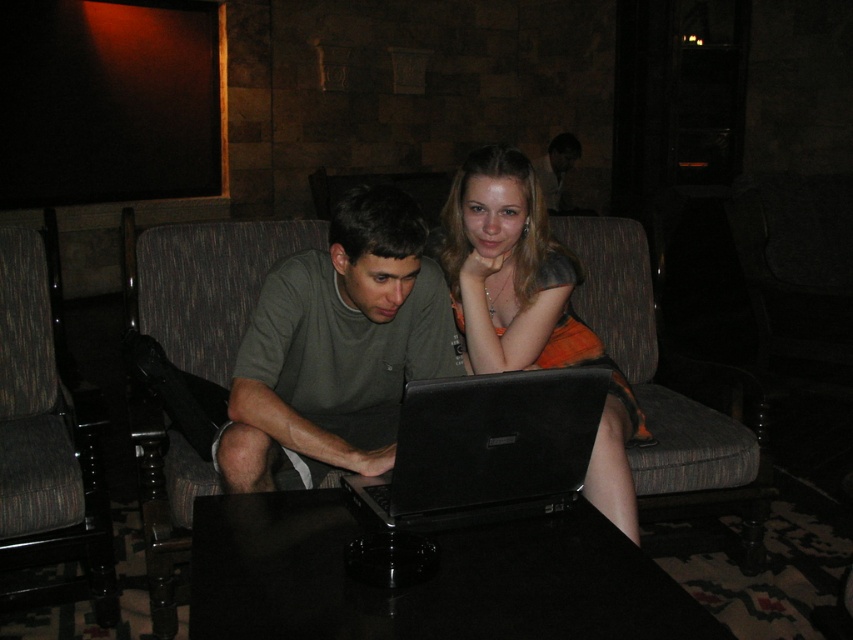
Is point (375, 234) positioned in front of point (437, 600)?

No, it is behind (437, 600).

Who is shorter, matte black laptop at center or black glossy table at center?

Standing shorter between the two is black glossy table at center.

Is point (395, 275) more distant than point (410, 600)?

Yes, it is behind point (410, 600).

This screenshot has width=853, height=640. Find the location of `matte black laptop at center`. matte black laptop at center is located at coordinates (412, 333).

The height and width of the screenshot is (640, 853). I want to click on matte black laptop at center, so click(x=412, y=333).

Describe the element at coordinates (412, 333) in the screenshot. I see `matte black laptop at center` at that location.

Who is more distant from viewer, (299, 456) or (184, 244)?

Positioned behind is point (184, 244).

At what (x,y) coordinates should I click in order to perform the action: click on matte black laptop at center. Please return your answer as a coordinate pair (x, y). The height and width of the screenshot is (640, 853). Looking at the image, I should click on (412, 333).

Based on the photo, which is more to the left, dark brown fabric armchair at left or dark gray fabric armchair at left?

From the viewer's perspective, dark brown fabric armchair at left appears more on the left side.

In the scene shown: Does dark brown fabric armchair at left have a lesser height compared to dark gray fabric armchair at left?

Indeed, dark brown fabric armchair at left has a lesser height compared to dark gray fabric armchair at left.

Image resolution: width=853 pixels, height=640 pixels. Identify the location of dark brown fabric armchair at left. (47, 440).

Where is `dark brown fabric armchair at left`? dark brown fabric armchair at left is located at coordinates (47, 440).